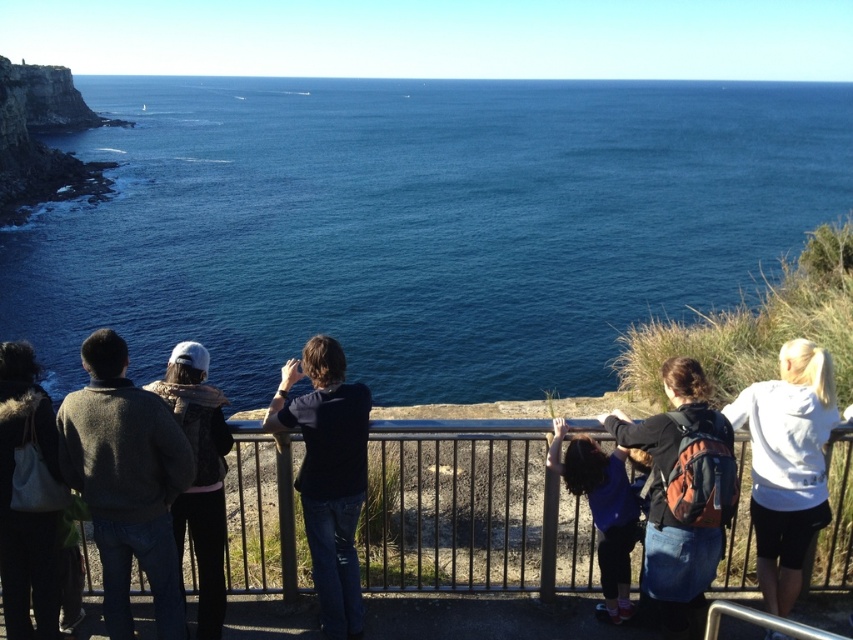
You are standing at the scenic overlook and want to take a photo of the ocean. There is a metallic gray railing at center marked by point (x=469, y=512). To ensure the railing doesn not block your view, where should you position yourself relative to the point?

To avoid the metallic gray railing at center marked by point (x=469, y=512) blocking your view, position yourself to the side of the point, either left or right, so the railing is out of frame.

You are standing at the scenic overlook and want to take a photo of the dark blue shirt at center. Where should you aim your camera to capture this person?

Aim your camera at the coordinates point (x=328, y=474) to capture the dark blue shirt at center.

You are standing at the overlook and want to take a photo of both the white fleece jacket at right and the denim jacket at center. Which jacket should you position closer to the left side of your camera frame to include both in the photo?

The white fleece jacket at right is positioned on the right side of denim jacket at center. To include both in the photo, position the denim jacket at center closer to the left side of your camera frame so that the white fleece jacket at right can be on the right side.